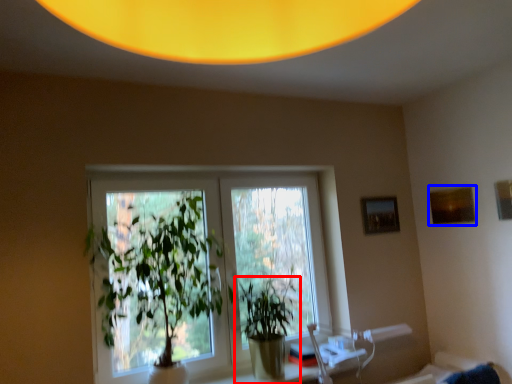
Question: Which of the following is the farthest to the observer, houseplant (highlighted by a red box) or picture frame (highlighted by a blue box)?

Choices:
 (A) houseplant
 (B) picture frame

Answer: (B)